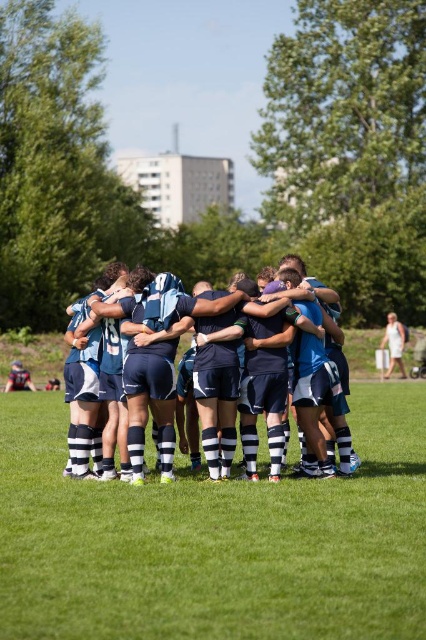
Question: Which of the following is the closest to the observer?

Choices:
 (A) blue jersey at center
 (B) green grass at center

Answer: (B)

Question: Considering the relative positions of green grass at center and blue jersey at center in the image provided, where is green grass at center located with respect to blue jersey at center?

Choices:
 (A) below
 (B) above

Answer: (A)

Question: Is green grass at center to the right of blue jersey at center from the viewer's perspective?

Choices:
 (A) no
 (B) yes

Answer: (B)

Question: Does green grass at center come behind blue jersey at center?

Choices:
 (A) no
 (B) yes

Answer: (A)

Question: Which point is farther to the camera?

Choices:
 (A) blue jersey at center
 (B) green grass at center

Answer: (A)